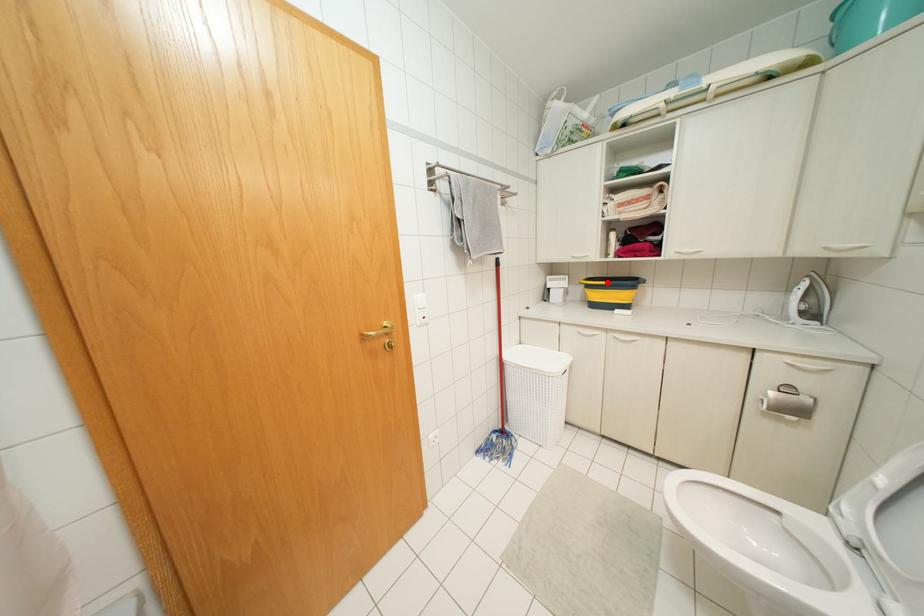
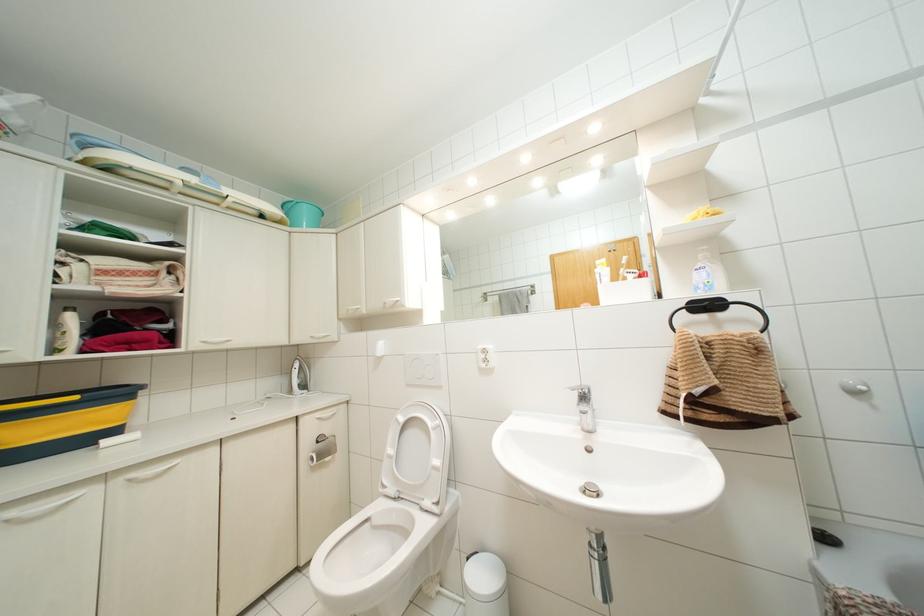
The point at the highlighted location is marked in the first image. Where is the corresponding point in the second image?

(75, 397)